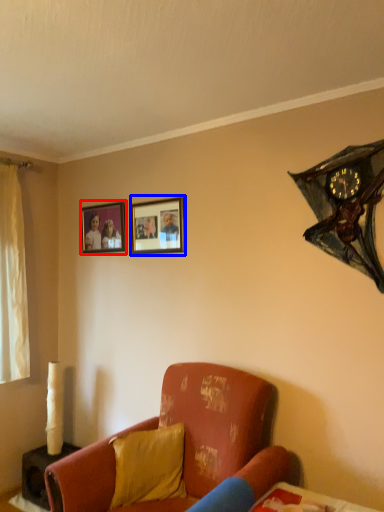
Question: Among these objects, which one is nearest to the camera, picture frame (highlighted by a red box) or picture frame (highlighted by a blue box)?

Choices:
 (A) picture frame
 (B) picture frame

Answer: (B)